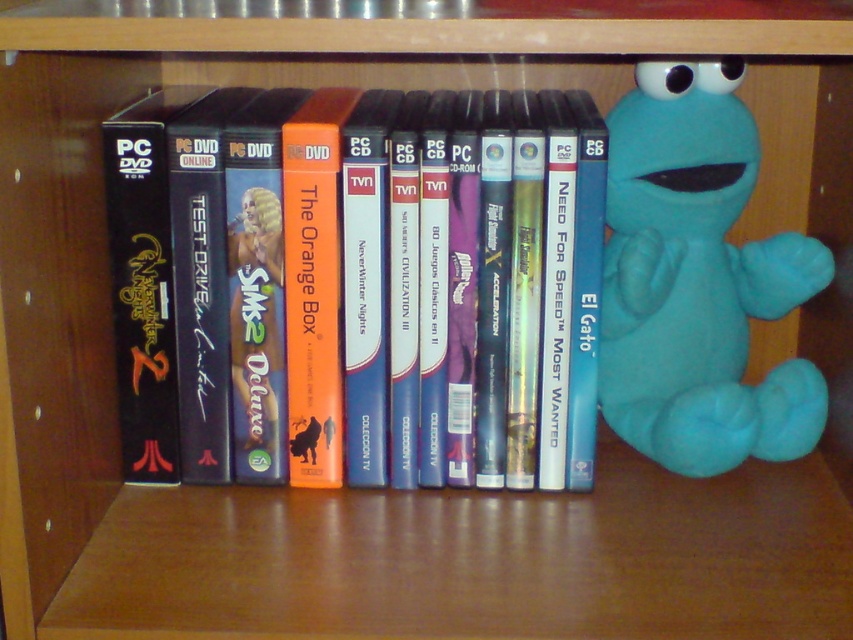
Between point (415, 464) and point (651, 221), which one is positioned behind?

The point (651, 221) is more distant.

Can you confirm if orange matte dvd case at center is thinner than teal plush toy at right?

Incorrect, orange matte dvd case at center's width is not less than teal plush toy at right's.

Who is more distant from viewer, (500, 269) or (618, 145)?

The point (618, 145) is behind.

You are a GUI agent. You are given a task and a screenshot of the screen. Output one action in this format:
    pyautogui.click(x=<x>, y=<y>)
    Task: Click on the orange matte dvd case at center
    
    Given the screenshot: What is the action you would take?
    pyautogui.click(x=467, y=282)